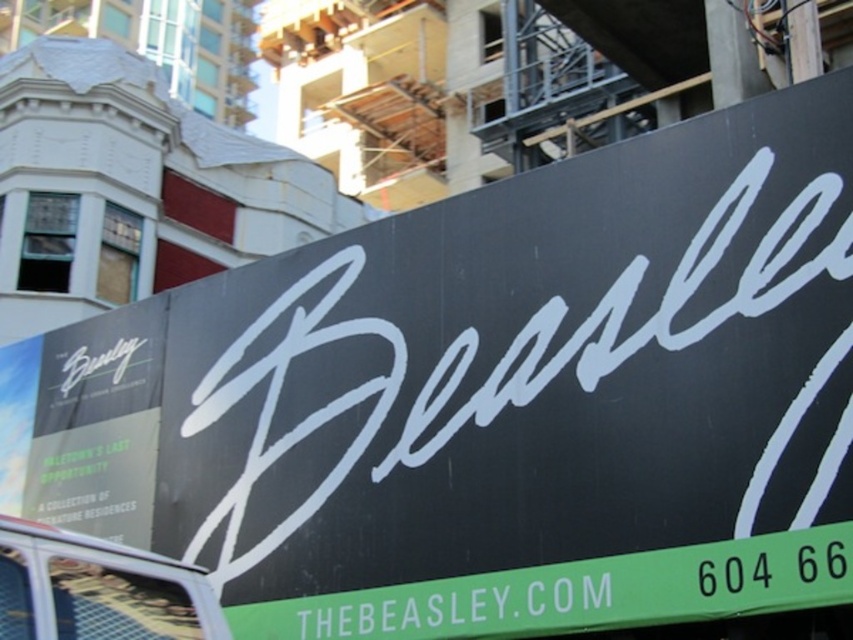
Does green matte signboard at bottom have a greater height compared to metallic silver food truck at lower left?

Indeed, green matte signboard at bottom has a greater height compared to metallic silver food truck at lower left.

Does point (585, 561) come behind point (134, 605)?

Yes.

I want to click on green matte signboard at bottom, so click(578, 593).

Who is positioned more to the right, green matte signboard at bottom or matte white sign at left?

Positioned to the right is green matte signboard at bottom.

Is point (239, 611) positioned after point (45, 424)?

That is False.

Find the location of a particular element. This screenshot has height=640, width=853. green matte signboard at bottom is located at coordinates (578, 593).

Does point (44, 484) come farther from viewer compared to point (6, 544)?

Yes, it is.

Is matte white sign at left positioned before metallic silver food truck at lower left?

No, it is behind metallic silver food truck at lower left.

What are the coordinates of `matte white sign at left` in the screenshot? It's located at (97, 420).